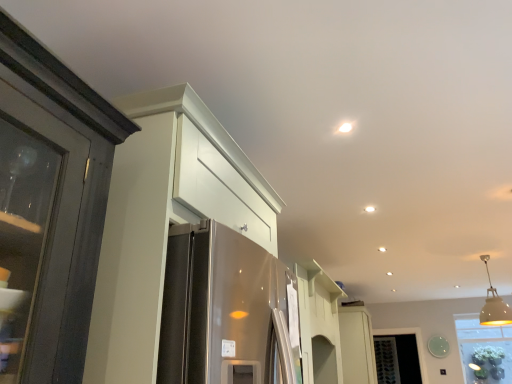
Where is `blank space above white matte pendant light at upper right (from a real-world perspective)`? This screenshot has height=384, width=512. blank space above white matte pendant light at upper right (from a real-world perspective) is located at coordinates (487, 250).